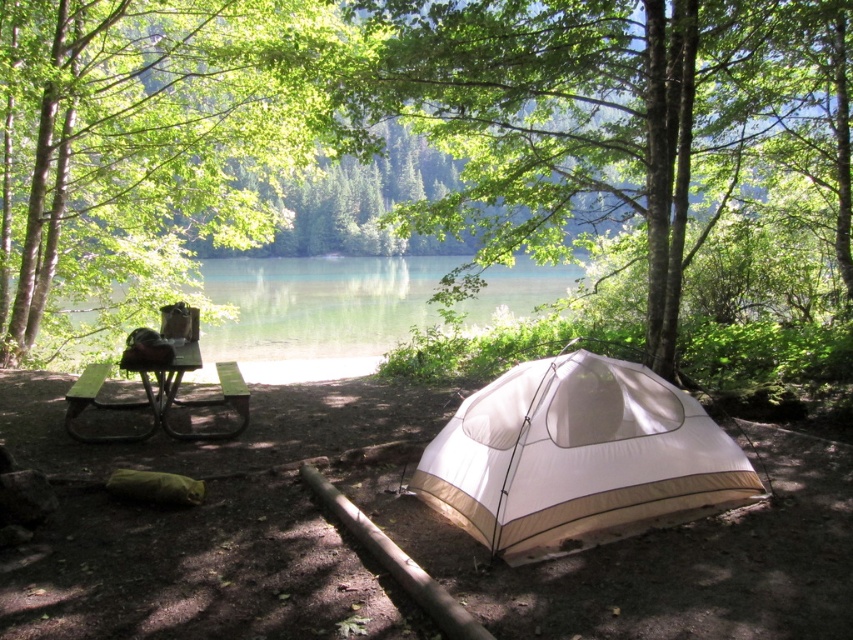
You are setting up a campsite and need to place a new tent. The current white tent is in the foreground, and there is a green leafy tree at center. Based on their positions, which object is closer to the center of the image?

The green leafy tree at center is located at point (433, 116), which is closer to the center of the image compared to the white tent in the foreground.

Looking at this image, you are a camper who wants to set up a small garden between the green leafy tree at center and the green leafy tree at left. The garden requires a space of 2 meters. Is there enough space between them to accommodate it?

The distance between the green leafy tree at center and the green leafy tree at left is 1.73 meters, which is less than the required 2 meters. Therefore, there is not enough space to set up the garden between them.